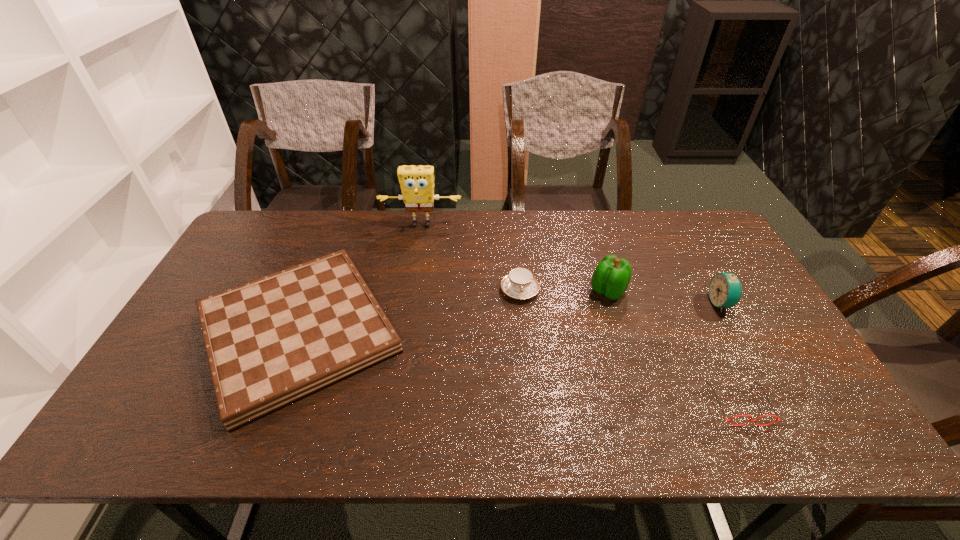
Where is `vacant space that satisfies the following two spatial constraints: 1. on the face of the tallest object; 2. on the left side of the bell pepper`? The image size is (960, 540). vacant space that satisfies the following two spatial constraints: 1. on the face of the tallest object; 2. on the left side of the bell pepper is located at coordinates (410, 291).